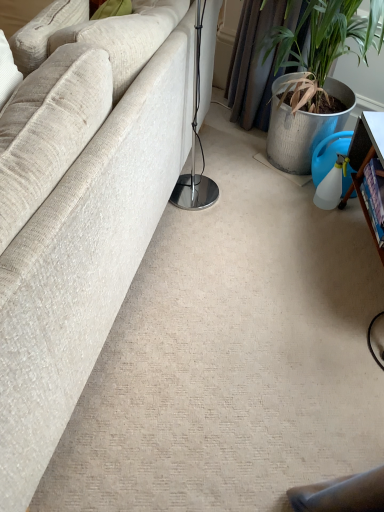
You are a GUI agent. You are given a task and a screenshot of the screen. Output one action in this format:
    pyautogui.click(x=<x>, y=<y>)
    Task: Click on the wooden bookshelf at right
    
    Given the screenshot: What is the action you would take?
    pyautogui.click(x=364, y=159)

The width and height of the screenshot is (384, 512). Describe the element at coordinates (364, 159) in the screenshot. I see `wooden bookshelf at right` at that location.

This screenshot has height=512, width=384. Describe the element at coordinates (81, 212) in the screenshot. I see `beige fabric couch at left` at that location.

Find the location of a particular element. Image resolution: width=384 pixels, height=512 pixels. beige fabric couch at left is located at coordinates (81, 212).

The height and width of the screenshot is (512, 384). I want to click on wooden bookshelf at right, so click(364, 159).

Between wooden bookshelf at right and beige fabric couch at left, which one appears on the right side from the viewer's perspective?

From the viewer's perspective, wooden bookshelf at right appears more on the right side.

Relative to beige fabric couch at left, is wooden bookshelf at right in front or behind?

wooden bookshelf at right is positioned farther from the viewer than beige fabric couch at left.

Which is closer to the camera, (382, 140) or (70, 118)?

Point (382, 140) is positioned farther from the camera compared to point (70, 118).

From the image's perspective, is wooden bookshelf at right positioned above or below beige fabric couch at left?

wooden bookshelf at right is below beige fabric couch at left.

Looking at this image, from a real-world perspective, which object stands above the other?

beige fabric couch at left is physically above.

Does wooden bookshelf at right have a greater width compared to beige fabric couch at left?

No, wooden bookshelf at right is not wider than beige fabric couch at left.

Is wooden bookshelf at right shorter than beige fabric couch at left?

Correct, wooden bookshelf at right is not as tall as beige fabric couch at left.

Considering the relative sizes of wooden bookshelf at right and beige fabric couch at left in the image provided, is wooden bookshelf at right smaller than beige fabric couch at left?

Indeed, wooden bookshelf at right has a smaller size compared to beige fabric couch at left.

Would you say wooden bookshelf at right is inside or outside beige fabric couch at left?

wooden bookshelf at right lies outside beige fabric couch at left.

Is wooden bookshelf at right with beige fabric couch at left?

wooden bookshelf at right is not next to beige fabric couch at left, and they're not touching.

Is wooden bookshelf at right turned away from beige fabric couch at left?

wooden bookshelf at right does not have its back to beige fabric couch at left.

How different are the orientations of wooden bookshelf at right and beige fabric couch at left in degrees?

The angular difference between wooden bookshelf at right and beige fabric couch at left is 7.75 degrees.

The image size is (384, 512). Find the location of `studio couch positioned vertically above the wooden bookshelf at right (from a real-world perspective)`. studio couch positioned vertically above the wooden bookshelf at right (from a real-world perspective) is located at coordinates (81, 212).

Does beige fabric couch at left appear on the left side of wooden bookshelf at right?

Yes.

Consider the image. Which object is further away from the camera taking this photo, beige fabric couch at left or wooden bookshelf at right?

Positioned behind is wooden bookshelf at right.

Is point (191, 93) positioned in front of point (368, 226)?

That is True.

From the image's perspective, is beige fabric couch at left located above wooden bookshelf at right?

Yes.

From a real-world perspective, which is physically below, beige fabric couch at left or wooden bookshelf at right?

From a 3D spatial view, wooden bookshelf at right is below.

In terms of width, does beige fabric couch at left look wider or thinner when compared to wooden bookshelf at right?

beige fabric couch at left is wider than wooden bookshelf at right.

In terms of height, does beige fabric couch at left look taller or shorter compared to wooden bookshelf at right?

Considering their sizes, beige fabric couch at left has more height than wooden bookshelf at right.

In the scene shown: Looking at the image, does beige fabric couch at left seem bigger or smaller compared to wooden bookshelf at right?

Clearly, beige fabric couch at left is larger in size than wooden bookshelf at right.

Can wooden bookshelf at right be found inside beige fabric couch at left?

No, wooden bookshelf at right is not inside beige fabric couch at left.

Would you say beige fabric couch at left is a long distance from wooden bookshelf at right?

That's not correct — beige fabric couch at left is a little close to wooden bookshelf at right.

Is beige fabric couch at left turned away from wooden bookshelf at right?

Yes, beige fabric couch at left's orientation is away from wooden bookshelf at right.

What's the angular difference between beige fabric couch at left and wooden bookshelf at right's facing directions?

The angle between the facing direction of beige fabric couch at left and the facing direction of wooden bookshelf at right is 7.75 degrees.

Where is `table on the right of beige fabric couch at left`? The width and height of the screenshot is (384, 512). table on the right of beige fabric couch at left is located at coordinates (364, 159).

Locate an element on the screen. Image resolution: width=384 pixels, height=512 pixels. table that is below the beige fabric couch at left (from the image's perspective) is located at coordinates (364, 159).

Locate an element on the screen. The image size is (384, 512). studio couch above the wooden bookshelf at right (from the image's perspective) is located at coordinates (81, 212).